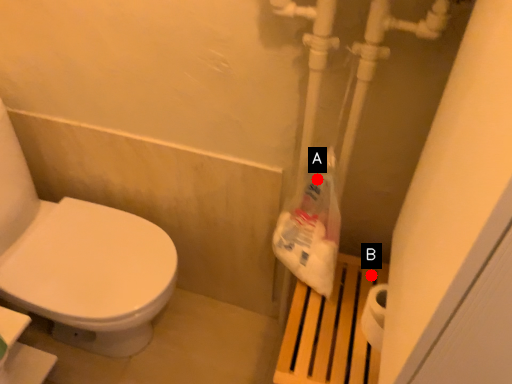
Question: Two points are circled on the image, labeled by A and B beside each circle. Which of the following is the farthest from the observer?

Choices:
 (A) A is further
 (B) B is further

Answer: (B)